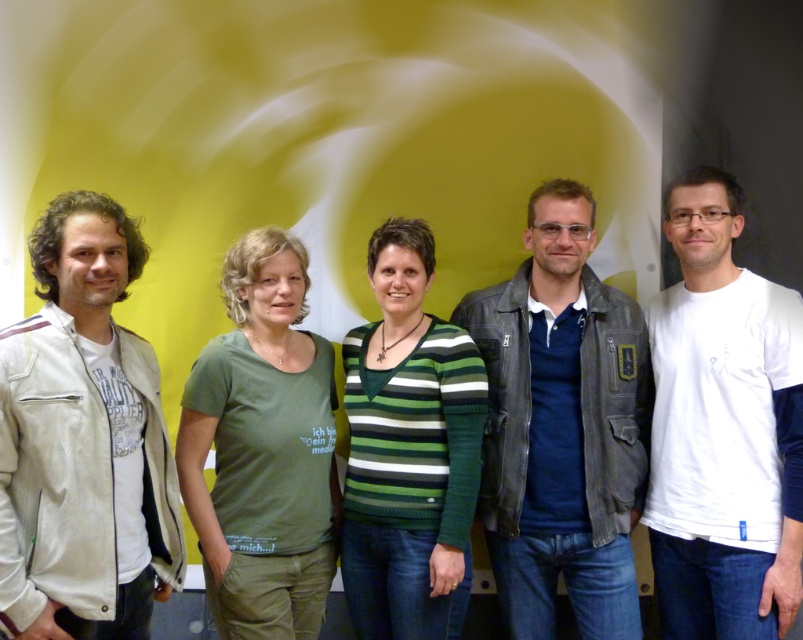
Question: Among these objects, which one is nearest to the camera?

Choices:
 (A) leather jacket at center
 (B) green cotton t-shirt at center
 (C) white matte t-shirt at right

Answer: (B)

Question: Can you confirm if leather jacket at center is thinner than green striped sweater at center?

Choices:
 (A) yes
 (B) no

Answer: (B)

Question: Which point is farther to the camera?

Choices:
 (A) (43, 348)
 (B) (528, 417)

Answer: (B)

Question: Can you confirm if leather jacket at center is positioned to the right of white matte t-shirt at right?

Choices:
 (A) yes
 (B) no

Answer: (B)

Question: Is green cotton t-shirt at center positioned behind green striped sweater at center?

Choices:
 (A) yes
 (B) no

Answer: (B)

Question: Which object is positioned closest to the white matte t-shirt at right?

Choices:
 (A) green striped sweater at center
 (B) white cotton jacket at left
 (C) green cotton t-shirt at center

Answer: (A)